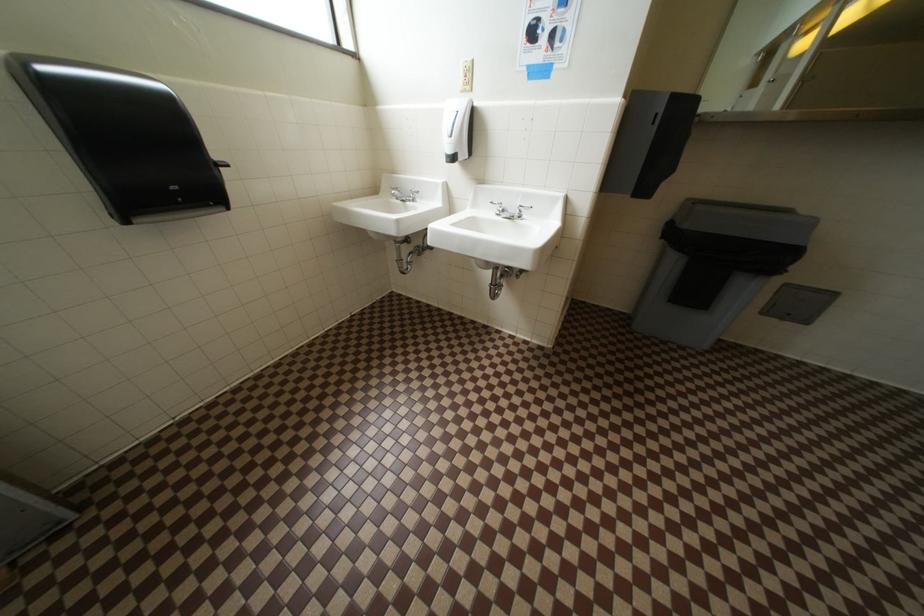
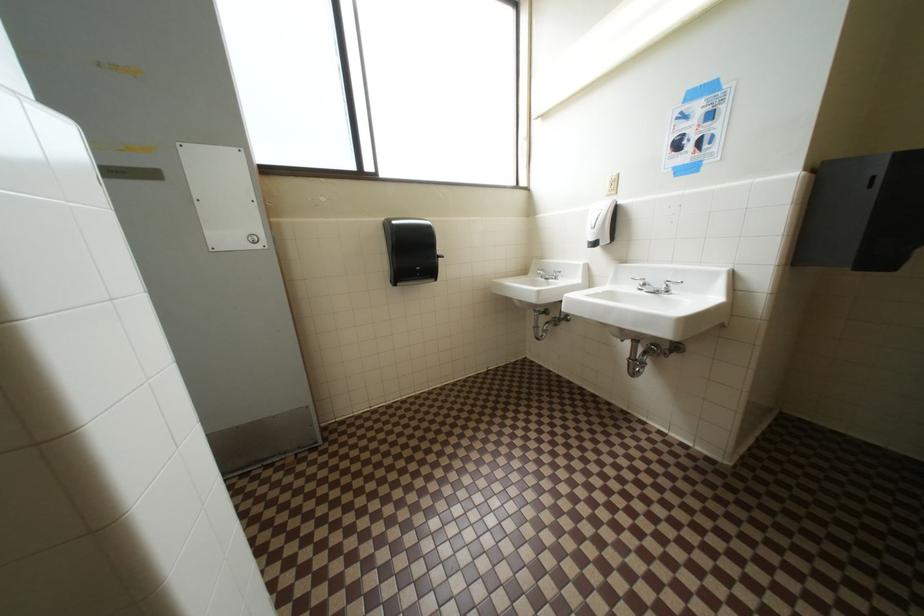
Question: The camera is either moving clockwise (left) or counter-clockwise (right) around the object. The first image is from the beginning of the video and the second image is from the end. Is the camera moving left or right when shooting the video?

Choices:
 (A) Left
 (B) Right

Answer: (B)